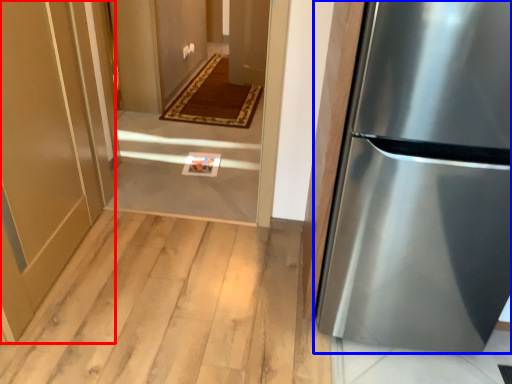
Question: Which object is further to the camera taking this photo, door (highlighted by a red box) or refrigerator (highlighted by a blue box)?

Choices:
 (A) door
 (B) refrigerator

Answer: (A)